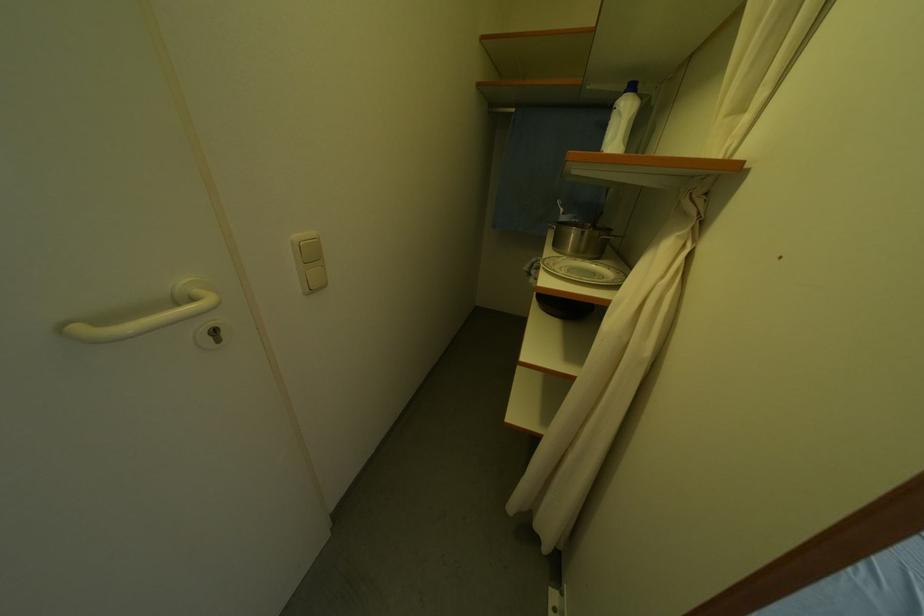
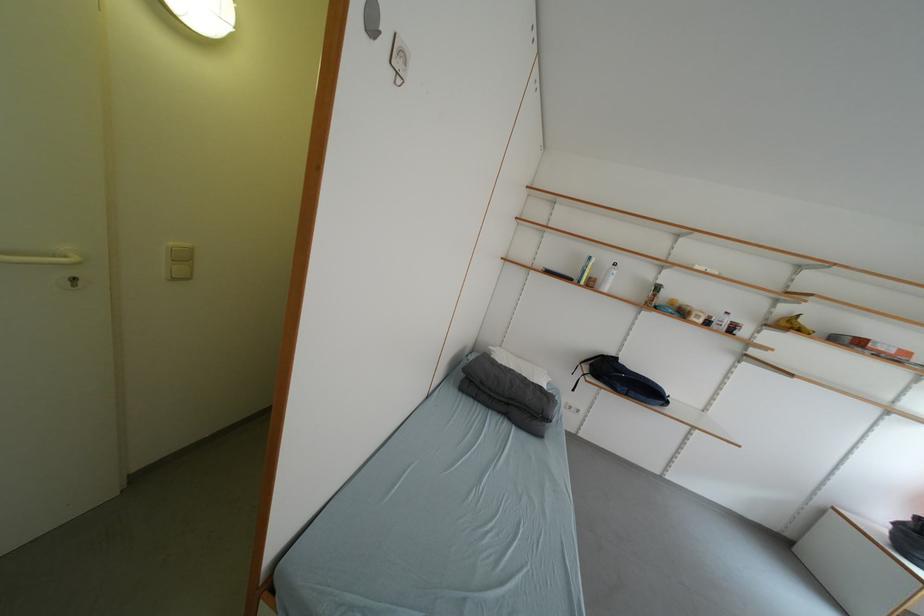
Question: Based on the continuous images, in which direction is the camera rotating? Reply with the corresponding letter.

Choices:
 (A) Left
 (B) Right
 (C) Up
 (D) Down

Answer: (C)